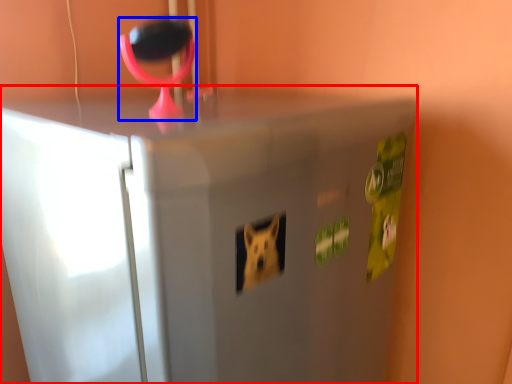
Question: Among these objects, which one is farthest to the camera, refrigerator (highlighted by a red box) or magnifying glass (highlighted by a blue box)?

Choices:
 (A) refrigerator
 (B) magnifying glass

Answer: (B)